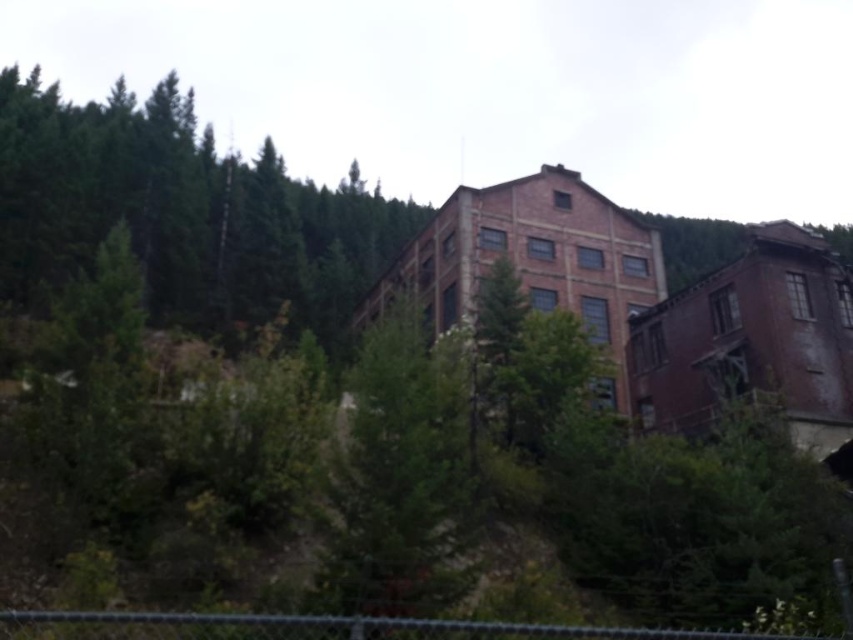
Which of these two, green matte tree at upper left or chain-link fence at lower center, stands taller?

green matte tree at upper left

Who is more distant from viewer, (50, 172) or (645, 636)?

The point (50, 172) is more distant.

Where is `green matte tree at upper left`? The image size is (853, 640). green matte tree at upper left is located at coordinates (183, 212).

Does green matte tree at upper left lie in front of green leafy tree at center?

No, green matte tree at upper left is further to the viewer.

Between point (51, 184) and point (428, 584), which one is positioned behind?

The point (51, 184) is more distant.

Where is `green matte tree at upper left`? This screenshot has height=640, width=853. green matte tree at upper left is located at coordinates (183, 212).

Does point (424, 547) come closer to viewer compared to point (86, 627)?

No.

Is green leafy tree at center wider than chain-link fence at lower center?

Incorrect, green leafy tree at center's width does not surpass chain-link fence at lower center's.

Image resolution: width=853 pixels, height=640 pixels. Find the location of `green leafy tree at center`. green leafy tree at center is located at coordinates (403, 476).